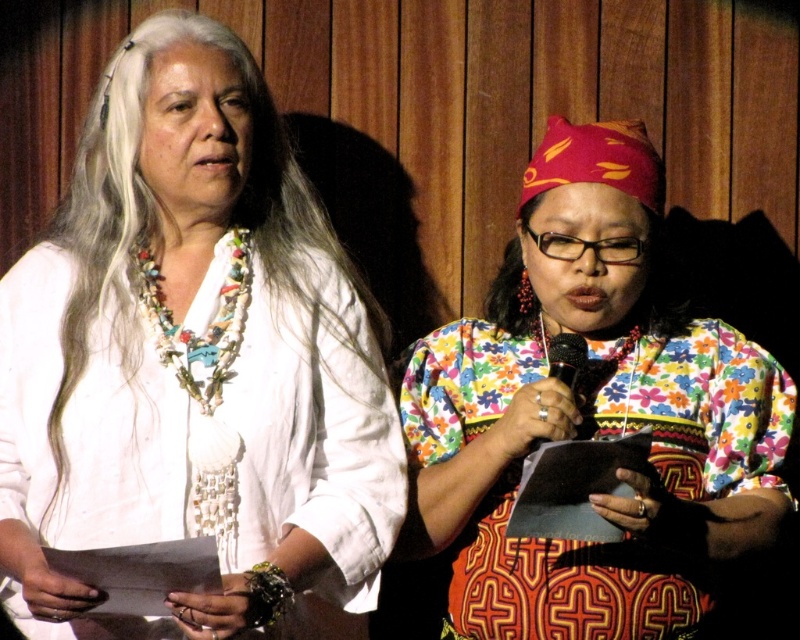
Which is more to the left, multicolored beaded necklace at left or matte silver necklace at center?

multicolored beaded necklace at left is more to the left.

How much distance is there between multicolored beaded necklace at left and matte silver necklace at center?

17.83 inches

Image resolution: width=800 pixels, height=640 pixels. What are the coordinates of `multicolored beaded necklace at left` in the screenshot? It's located at (206, 385).

Can you confirm if floral fabric dress at center is positioned above multicolored beaded necklace at left?

Yes.

Which is behind, point (600, 605) or point (232, 484)?

The point (600, 605) is more distant.

Where is `floral fabric dress at center`? The width and height of the screenshot is (800, 640). floral fabric dress at center is located at coordinates (592, 412).

Identify the location of floral fabric dress at center. The width and height of the screenshot is (800, 640). (592, 412).

Is white beaded necklace at center below multicolored beaded necklace at left?

No, white beaded necklace at center is not below multicolored beaded necklace at left.

Does white beaded necklace at center appear on the left side of multicolored beaded necklace at left?

Indeed, white beaded necklace at center is positioned on the left side of multicolored beaded necklace at left.

Who is more forward, (186, 145) or (218, 362)?

Point (186, 145)

Locate an element on the screen. Image resolution: width=800 pixels, height=640 pixels. white beaded necklace at center is located at coordinates (192, 356).